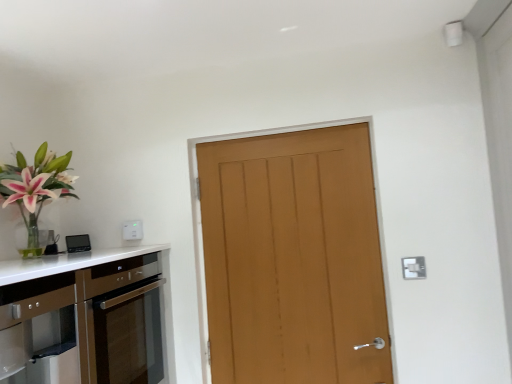
In order to face satin brown cabinetry at lower left, should I rotate leftwards or rightwards?

Rotate left and turn 22.192 degrees.

In the scene shown: Measure the distance between satin brown cabinetry at lower left and camera.

The depth of satin brown cabinetry at lower left is 1.05 meters.

In order to face white plastic electric outlet at upper center, the 2th electric outlet viewed from the front, should I rotate leftwards or rightwards?

Rotate your view left by about 16.360°.

What are the coordinates of `satin brown cabinetry at lower left` in the screenshot? It's located at (82, 318).

Which of these two, white plastic electric outlet at upper center, the 2th electric outlet positioned from the right, or white plastic electric outlet at upper right, which appears as the second electric outlet when viewed from the left, is wider?

white plastic electric outlet at upper center, the 2th electric outlet positioned from the right, is wider.

Considering the relative positions of white plastic electric outlet at upper center, which appears as the first electric outlet when viewed from the top, and white plastic electric outlet at upper right, the second electric outlet positioned from the top, in the image provided, is white plastic electric outlet at upper center, which appears as the first electric outlet when viewed from the top, to the left of white plastic electric outlet at upper right, the second electric outlet positioned from the top, from the viewer's perspective?

Yes.

Considering their positions, is white plastic electric outlet at upper center, arranged as the 1th electric outlet when viewed from the back, located in front of or behind white plastic electric outlet at upper right, which ranks as the first electric outlet in right-to-left order?

white plastic electric outlet at upper center, arranged as the 1th electric outlet when viewed from the back, is positioned farther from the viewer than white plastic electric outlet at upper right, which ranks as the first electric outlet in right-to-left order.

Does white plastic electric outlet at upper center, the second electric outlet positioned from the bottom, have a greater height compared to white plastic electric outlet at upper right, the second electric outlet positioned from the top?

No, white plastic electric outlet at upper center, the second electric outlet positioned from the bottom, is not taller than white plastic electric outlet at upper right, the second electric outlet positioned from the top.

Does white plastic electric outlet at upper right, positioned as the first electric outlet in front-to-back order, turn towards satin brown cabinetry at lower left?

No, white plastic electric outlet at upper right, positioned as the first electric outlet in front-to-back order, is not facing towards satin brown cabinetry at lower left.

Does white plastic electric outlet at upper right, positioned as the first electric outlet in front-to-back order, come behind satin brown cabinetry at lower left?

Yes.

Which of these two, white plastic electric outlet at upper right, positioned as the first electric outlet in front-to-back order, or satin brown cabinetry at lower left, stands taller?

Standing taller between the two is satin brown cabinetry at lower left.

From the image's perspective, is white plastic electric outlet at upper right, which is the second electric outlet from back to front, positioned above or below wooden door at center?

white plastic electric outlet at upper right, which is the second electric outlet from back to front, is below wooden door at center.

In the scene shown: Does white plastic electric outlet at upper right, which is the second electric outlet from back to front, come behind wooden door at center?

No, white plastic electric outlet at upper right, which is the second electric outlet from back to front, is closer to the viewer.

Which object is positioned more to the right, white plastic electric outlet at upper right, which is the second electric outlet from back to front, or wooden door at center?

Positioned to the right is white plastic electric outlet at upper right, which is the second electric outlet from back to front.

Is white plastic electric outlet at upper right, which is the second electric outlet from back to front, outside of white plastic electric outlet at upper center, arranged as the 1th electric outlet when viewed from the back?

Absolutely, white plastic electric outlet at upper right, which is the second electric outlet from back to front, is external to white plastic electric outlet at upper center, arranged as the 1th electric outlet when viewed from the back.

Which of these two, white plastic electric outlet at upper right, the second electric outlet positioned from the top, or white plastic electric outlet at upper center, which appears as the first electric outlet when viewed from the top, stands shorter?

Result: white plastic electric outlet at upper center, which appears as the first electric outlet when viewed from the top, is shorter.

From a real-world perspective, relative to wooden door at center, is satin brown cabinetry at lower left vertically above or below?

In terms of real-world spatial position, satin brown cabinetry at lower left is below wooden door at center.

Which is behind, satin brown cabinetry at lower left or wooden door at center?

Positioned behind is wooden door at center.

Identify the location of door behind the satin brown cabinetry at lower left. The width and height of the screenshot is (512, 384). (293, 258).

In the scene shown: Which of these two, wooden door at center or satin brown cabinetry at lower left, is smaller?

Smaller between the two is wooden door at center.

Can you tell me how much wooden door at center and satin brown cabinetry at lower left differ in facing direction?

The angle between the facing direction of wooden door at center and the facing direction of satin brown cabinetry at lower left is 91.2 degrees.

Considering the positions of objects wooden door at center and satin brown cabinetry at lower left in the image provided, who is more to the right, wooden door at center or satin brown cabinetry at lower left?

From the viewer's perspective, wooden door at center appears more on the right side.

From the image's perspective, between wooden door at center and satin brown cabinetry at lower left, who is located below?

satin brown cabinetry at lower left appears lower in the image.

Is point (134, 232) positioned after point (70, 376)?

That is True.

From the picture: Which of these two, white plastic electric outlet at upper center, marked as the 1th electric outlet in a left-to-right arrangement, or satin brown cabinetry at lower left, is bigger?

satin brown cabinetry at lower left.

Is white plastic electric outlet at upper center, the 2th electric outlet viewed from the front, aimed at satin brown cabinetry at lower left?

No, white plastic electric outlet at upper center, the 2th electric outlet viewed from the front, is not oriented towards satin brown cabinetry at lower left.

Can you see white plastic electric outlet at upper center, the 2th electric outlet positioned from the right, touching satin brown cabinetry at lower left?

white plastic electric outlet at upper center, the 2th electric outlet positioned from the right, is not next to satin brown cabinetry at lower left, and they're not touching.

At what (x,y) coordinates should I click in order to perform the action: click on electric outlet that is below the white plastic electric outlet at upper center, the 2th electric outlet viewed from the front (from the image's perspective). Please return your answer as a coordinate pair (x, y). This screenshot has width=512, height=384. Looking at the image, I should click on pos(413,267).

At what (x,y) coordinates should I click in order to perform the action: click on cabinetry below the white plastic electric outlet at upper right, which ranks as the first electric outlet in right-to-left order (from a real-world perspective). Please return your answer as a coordinate pair (x, y). The height and width of the screenshot is (384, 512). Looking at the image, I should click on (82, 318).

Considering their positions, is satin brown cabinetry at lower left positioned further to white plastic electric outlet at upper center, which appears as the first electric outlet when viewed from the top, than wooden door at center?

The object further to white plastic electric outlet at upper center, which appears as the first electric outlet when viewed from the top, is wooden door at center.

Estimate the real-world distances between objects in this image. Which object is further from wooden door at center, white plastic electric outlet at upper right, placed as the first electric outlet when sorted from bottom to top, or satin brown cabinetry at lower left?

The object further to wooden door at center is satin brown cabinetry at lower left.

When comparing their distances from satin brown cabinetry at lower left, does white plastic electric outlet at upper center, which appears as the first electric outlet when viewed from the top, or wooden door at center seem closer?

white plastic electric outlet at upper center, which appears as the first electric outlet when viewed from the top.

When comparing their distances from satin brown cabinetry at lower left, does white plastic electric outlet at upper right, the second electric outlet positioned from the top, or wooden door at center seem closer?

The object closer to satin brown cabinetry at lower left is wooden door at center.

Which object lies nearer to the anchor point white plastic electric outlet at upper center, the 2th electric outlet positioned from the right, white plastic electric outlet at upper right, the second electric outlet positioned from the top, or wooden door at center?

Based on the image, wooden door at center appears to be nearer to white plastic electric outlet at upper center, the 2th electric outlet positioned from the right.

Based on their spatial positions, is wooden door at center or white plastic electric outlet at upper right, which appears as the second electric outlet when viewed from the left, closer to satin brown cabinetry at lower left?

wooden door at center is positioned closer to the anchor satin brown cabinetry at lower left.

From the picture: From the image, which object appears to be farther from white plastic electric outlet at upper center, which appears as the first electric outlet when viewed from the top, satin brown cabinetry at lower left or white plastic electric outlet at upper right, which is the second electric outlet from back to front?

white plastic electric outlet at upper right, which is the second electric outlet from back to front, lies further to white plastic electric outlet at upper center, which appears as the first electric outlet when viewed from the top, than the other object.

When comparing their distances from satin brown cabinetry at lower left, does wooden door at center or white plastic electric outlet at upper center, marked as the 1th electric outlet in a left-to-right arrangement, seem closer?

white plastic electric outlet at upper center, marked as the 1th electric outlet in a left-to-right arrangement, is positioned closer to the anchor satin brown cabinetry at lower left.

This screenshot has height=384, width=512. What are the coordinates of `door between white plastic electric outlet at upper center, arranged as the 1th electric outlet when viewed from the back, and white plastic electric outlet at upper right, positioned as the first electric outlet in front-to-back order` in the screenshot? It's located at click(x=293, y=258).

Where is `electric outlet between satin brown cabinetry at lower left and wooden door at center in the horizontal direction`? This screenshot has width=512, height=384. electric outlet between satin brown cabinetry at lower left and wooden door at center in the horizontal direction is located at coordinates (133, 230).

Where is `electric outlet situated between satin brown cabinetry at lower left and white plastic electric outlet at upper right, which ranks as the first electric outlet in right-to-left order, from left to right`? The image size is (512, 384). electric outlet situated between satin brown cabinetry at lower left and white plastic electric outlet at upper right, which ranks as the first electric outlet in right-to-left order, from left to right is located at coordinates (133, 230).

Image resolution: width=512 pixels, height=384 pixels. I want to click on door situated between satin brown cabinetry at lower left and white plastic electric outlet at upper right, which ranks as the first electric outlet in right-to-left order, from left to right, so click(293, 258).